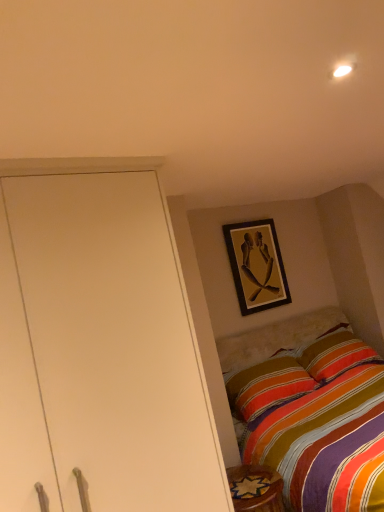
Question: From a real-world perspective, does carpeted rug at lower right sit lower than wooden framed artwork at upper center?

Choices:
 (A) yes
 (B) no

Answer: (A)

Question: Is carpeted rug at lower right taller than wooden framed artwork at upper center?

Choices:
 (A) no
 (B) yes

Answer: (A)

Question: Considering the relative positions of carpeted rug at lower right and wooden framed artwork at upper center in the image provided, is carpeted rug at lower right behind wooden framed artwork at upper center?

Choices:
 (A) no
 (B) yes

Answer: (A)

Question: Is carpeted rug at lower right thinner than wooden framed artwork at upper center?

Choices:
 (A) no
 (B) yes

Answer: (A)

Question: Can we say carpeted rug at lower right lies outside wooden framed artwork at upper center?

Choices:
 (A) yes
 (B) no

Answer: (A)

Question: Considering the relative sizes of carpeted rug at lower right and wooden framed artwork at upper center in the image provided, is carpeted rug at lower right bigger than wooden framed artwork at upper center?

Choices:
 (A) no
 (B) yes

Answer: (A)

Question: Can you confirm if wooden framed artwork at upper center is wider than carpeted rug at lower right?

Choices:
 (A) yes
 (B) no

Answer: (B)

Question: Considering the relative positions of wooden framed artwork at upper center and carpeted rug at lower right in the image provided, is wooden framed artwork at upper center to the left of carpeted rug at lower right from the viewer's perspective?

Choices:
 (A) no
 (B) yes

Answer: (A)

Question: Is wooden framed artwork at upper center further to the viewer compared to carpeted rug at lower right?

Choices:
 (A) yes
 (B) no

Answer: (A)

Question: Can you confirm if wooden framed artwork at upper center is bigger than carpeted rug at lower right?

Choices:
 (A) no
 (B) yes

Answer: (B)

Question: Can you confirm if wooden framed artwork at upper center is positioned to the right of carpeted rug at lower right?

Choices:
 (A) yes
 (B) no

Answer: (A)

Question: Does wooden framed artwork at upper center have a greater height compared to carpeted rug at lower right?

Choices:
 (A) no
 (B) yes

Answer: (B)

Question: In terms of height, does carpeted rug at lower right look taller or shorter compared to wooden framed artwork at upper center?

Choices:
 (A) tall
 (B) short

Answer: (B)